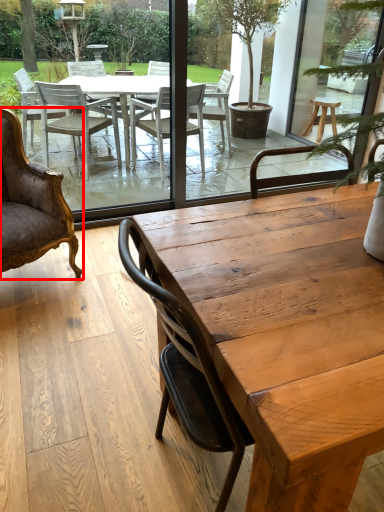
Question: From the image, what is the correct spatial relationship of chair (annotated by the red box) in relation to coffee table?

Choices:
 (A) left
 (B) right

Answer: (A)